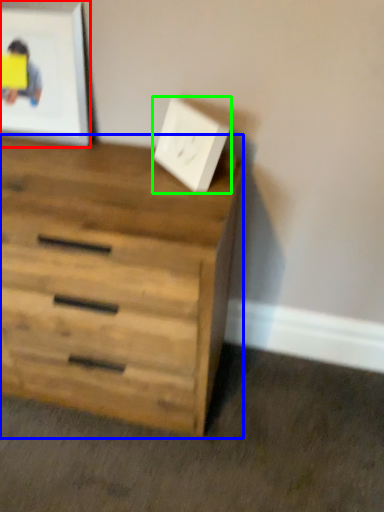
Question: Considering the real-world distances, which object is closest to picture frame (highlighted by a red box)? chest of drawers (highlighted by a blue box) or electric outlet (highlighted by a green box).

Choices:
 (A) chest of drawers
 (B) electric outlet

Answer: (B)